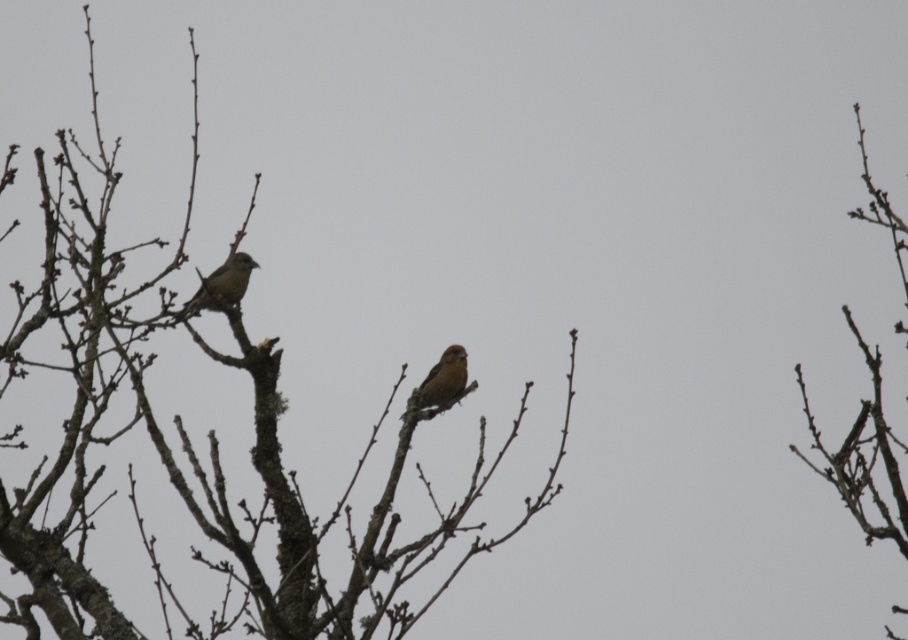
You are a birdwatcher trying to identify the species of the birds in the image. You notice the brown matte bird at left and the brown textured tree at center. Which object is bigger in size?

The brown textured tree at center is larger in size than the brown matte bird at left.

You are standing at the origin point of the coordinate system. You want to walk to the brown textured tree at center. What direction should you head towards?

The brown textured tree at center is located at coordinate point 0.702 in the x direction and 0.214 in the y direction. Since you are at the origin, you should move towards the positive x and positive y directions to reach it.